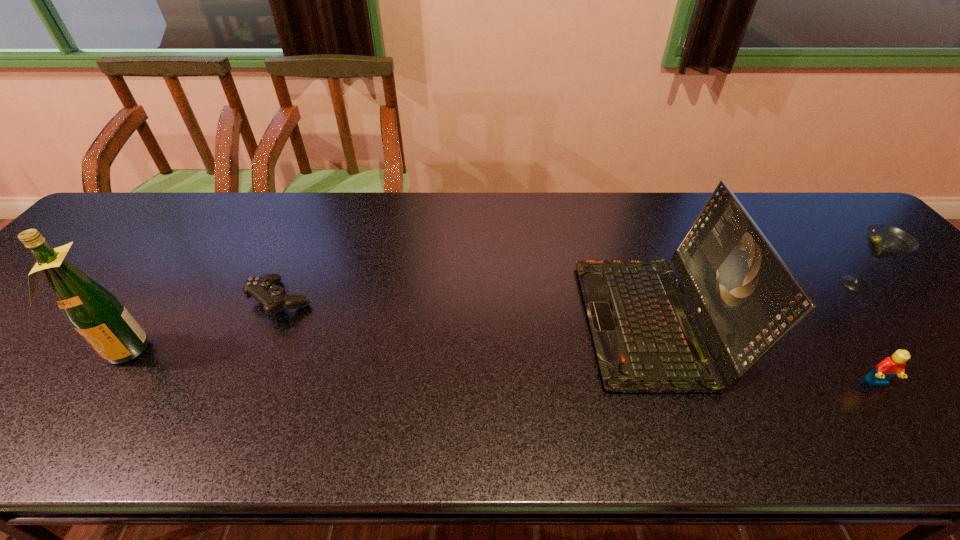
Locate an element on the screen. Image resolution: width=960 pixels, height=540 pixels. free spot located 0.120m on the front-facing side of the liquor is located at coordinates (73, 422).

You are a GUI agent. You are given a task and a screenshot of the screen. Output one action in this format:
    pyautogui.click(x=<x>, y=<y>)
    Task: Click on the vacant space located on the screen of the laptop computer
    This screenshot has height=540, width=960.
    Given the screenshot: What is the action you would take?
    coord(480,321)

Find the location of a particular element. The image size is (960, 540). vacant space located on the screen of the laptop computer is located at coordinates (536, 321).

The image size is (960, 540). Find the location of `free region located 0.150m on the screen of the laptop computer`. free region located 0.150m on the screen of the laptop computer is located at coordinates (523, 321).

Find the location of a particular element. free space located 0.130m on the back of the third shortest object is located at coordinates (816, 238).

Where is `vacant space situated 0.060m on the face of the second shortest object`? vacant space situated 0.060m on the face of the second shortest object is located at coordinates (901, 416).

Image resolution: width=960 pixels, height=540 pixels. Identify the location of vacant space situated 0.290m on the front of the control. tap(217, 445).

At what (x,y) coordinates should I click in order to perform the action: click on object that is at the right edge. Please return your answer as a coordinate pair (x, y). Image resolution: width=960 pixels, height=540 pixels. Looking at the image, I should click on (884, 241).

What are the coordinates of `vacant space at the far edge of the desktop` in the screenshot? It's located at (576, 239).

I want to click on free space at the left edge of the desktop, so click(91, 257).